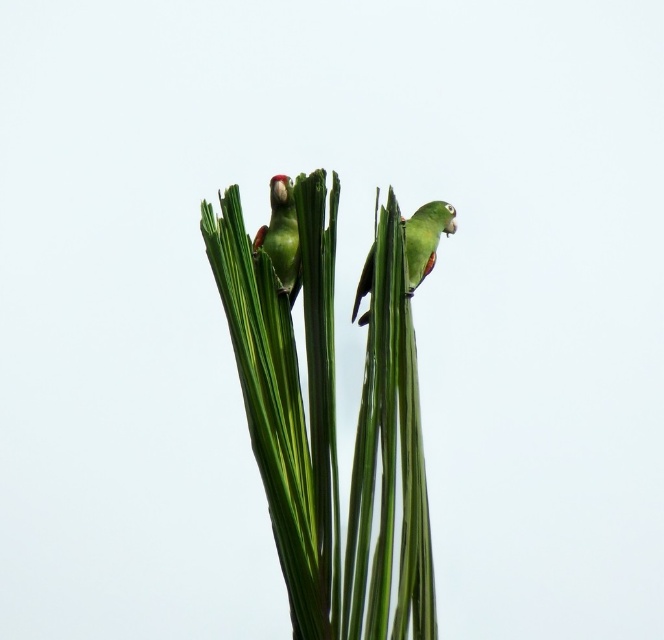
Does point (386, 307) lie in front of point (297, 289)?

Yes, point (386, 307) is closer to viewer.

Who is positioned more to the left, green leafy plant at center or green matte parrot at center?

green matte parrot at center

Find the location of a particular element. This screenshot has height=640, width=664. green leafy plant at center is located at coordinates [x=329, y=422].

Is green leafy plant at center in front of green matte parrot at upper center?

Yes, green leafy plant at center is closer to the viewer.

Is point (400, 264) closer to camera compared to point (452, 216)?

Yes, point (400, 264) is in front of point (452, 216).

You are a GUI agent. You are given a task and a screenshot of the screen. Output one action in this format:
    pyautogui.click(x=<x>, y=<y>)
    Task: Click on the green leafy plant at center
    The width and height of the screenshot is (664, 640).
    Given the screenshot: What is the action you would take?
    pyautogui.click(x=329, y=422)

Is point (408, 257) positioned behind point (276, 177)?

Yes, point (408, 257) is behind point (276, 177).

Is green matte parrot at upper center to the left of green matte parrot at center from the viewer's perspective?

No, green matte parrot at upper center is not to the left of green matte parrot at center.

Find the location of `green matte parrot at upper center`. green matte parrot at upper center is located at coordinates (426, 237).

The height and width of the screenshot is (640, 664). What are the coordinates of `green matte parrot at upper center` in the screenshot? It's located at [426, 237].